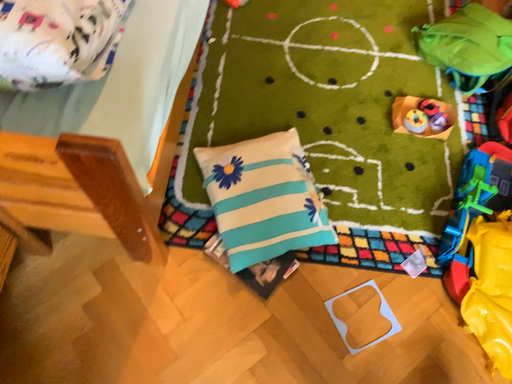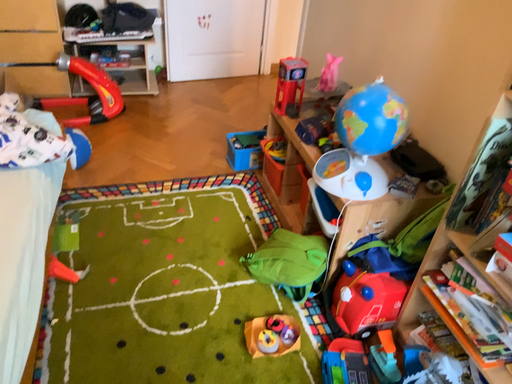
Question: Which way did the camera rotate in the video?

Choices:
 (A) rotated downward
 (B) rotated upward

Answer: (B)